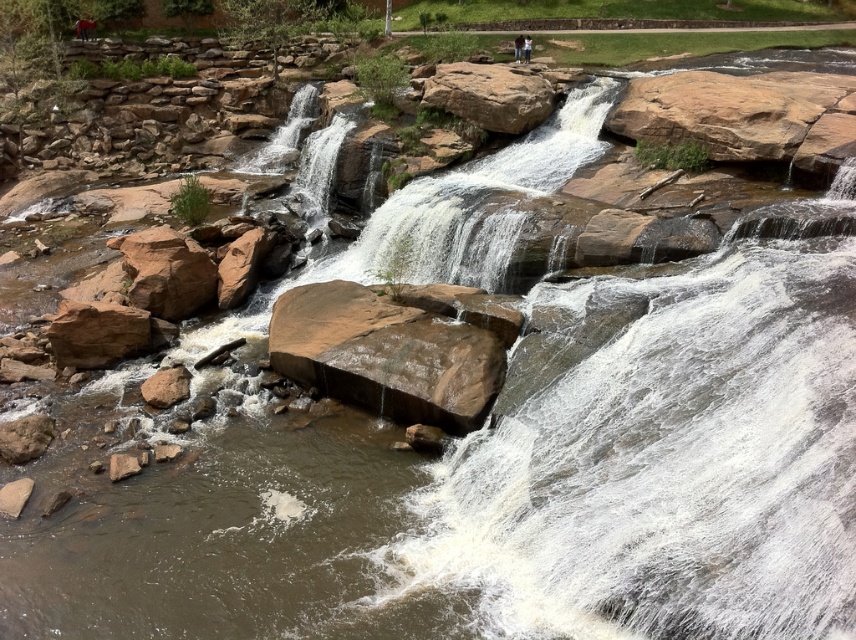
Question: Estimate the real-world distances between objects in this image. Which object is farther from the brown rough rock at left?

Choices:
 (A) smooth rock waterfall at center
 (B) brown rough rock at lower left

Answer: (A)

Question: Which object appears closest to the camera in this image?

Choices:
 (A) brown rough rock at center
 (B) brown rough rock at upper center
 (C) brown rough rock at lower left
 (D) dark blue jeans at center

Answer: (A)

Question: From the image, what is the correct spatial relationship of brown rough rock at upper center in relation to blurred human figure at upper center?

Choices:
 (A) right
 (B) left

Answer: (B)

Question: Among these points, which one is farthest from the camera?

Choices:
 (A) (536, 538)
 (B) (179, 369)

Answer: (B)

Question: Is smooth rock waterfall at center to the left of dark blue jeans at center from the viewer's perspective?

Choices:
 (A) yes
 (B) no

Answer: (A)

Question: Can you confirm if smooth rock waterfall at center is bigger than brown rough rock at center?

Choices:
 (A) yes
 (B) no

Answer: (B)